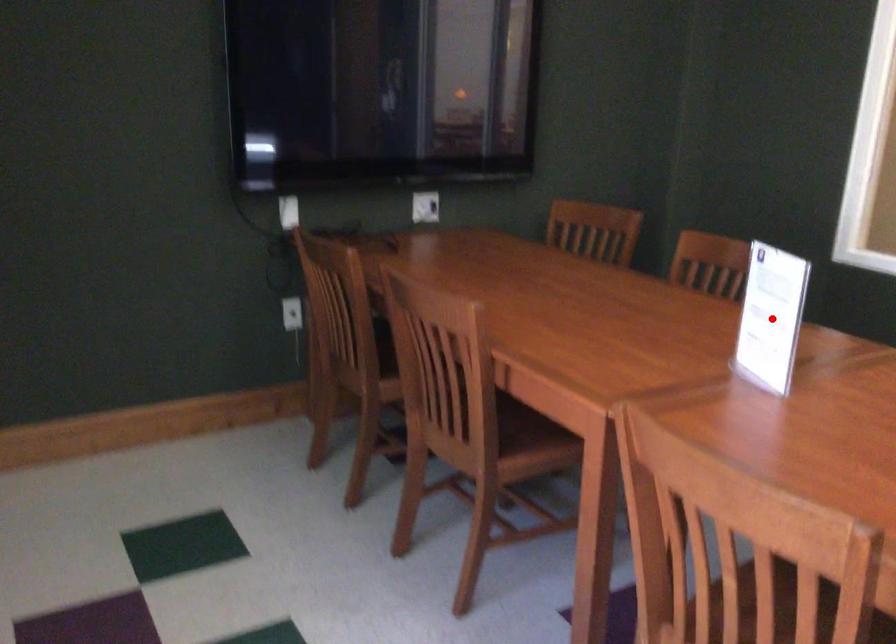
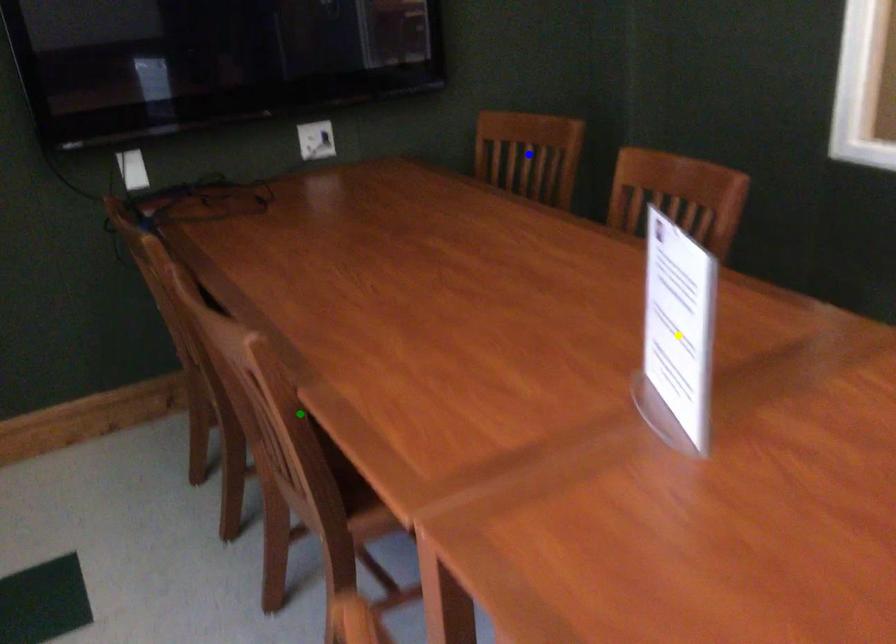
Question: I am providing you with two images of the same scene from different viewpoints. A red point is marked on the first image. You are given multiple points on the second image. Which mark in image 2 goes with the point in image 1?

Choices:
 (A) green point
 (B) blue point
 (C) yellow point

Answer: (C)